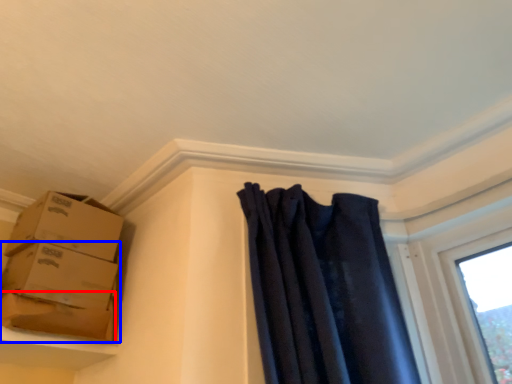
Question: Which object is further to the camera taking this photo, cardboard box (highlighted by a red box) or box (highlighted by a blue box)?

Choices:
 (A) cardboard box
 (B) box

Answer: (B)